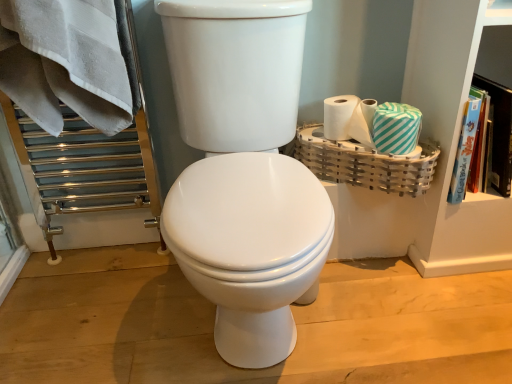
Where is `vacant space to the right of white glossy toilet at center`? Image resolution: width=512 pixels, height=384 pixels. vacant space to the right of white glossy toilet at center is located at coordinates (400, 306).